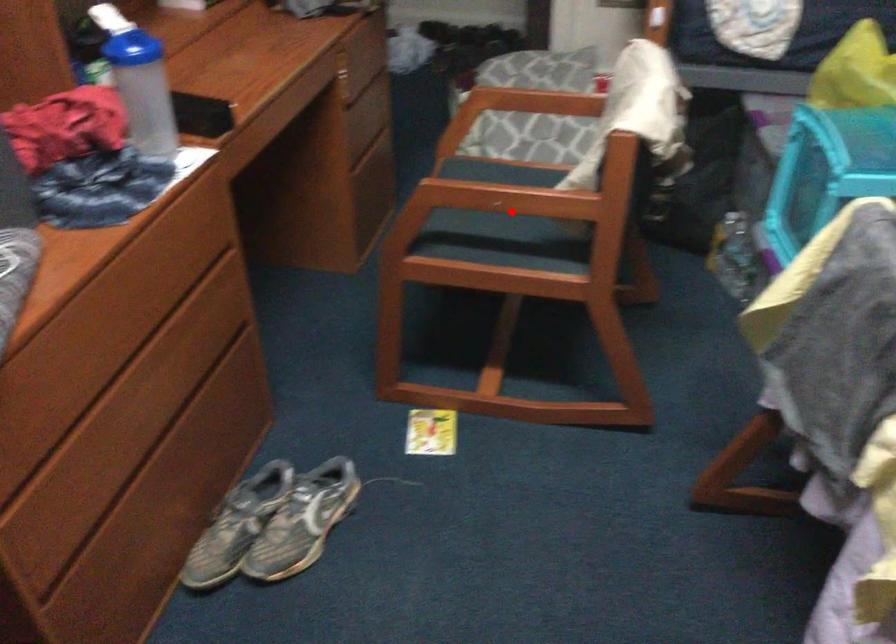
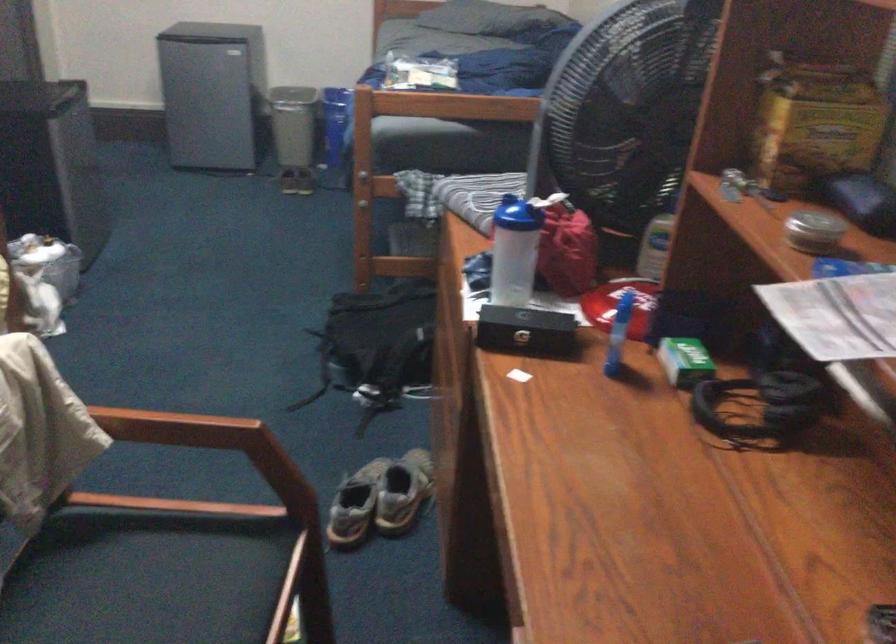
Locate, in the second image, the point that corresponds to the highlighted location in the first image.

(162, 579)